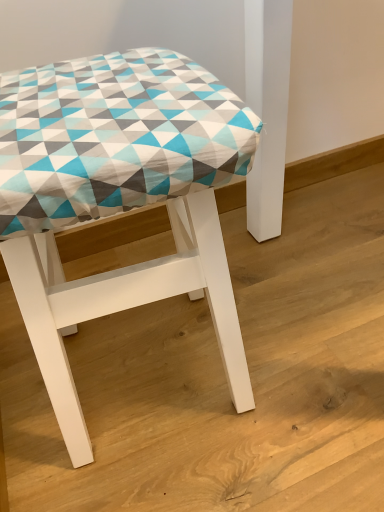
What do you see at coordinates (118, 198) in the screenshot?
I see `matte fabric stool at center` at bounding box center [118, 198].

You are a GUI agent. You are given a task and a screenshot of the screen. Output one action in this format:
    pyautogui.click(x=<x>, y=<y>)
    Task: Click on the matte fabric stool at center
    
    Given the screenshot: What is the action you would take?
    pyautogui.click(x=118, y=198)

Find the location of a particular element. Image resolution: width=384 pixels, height=512 pixels. matte fabric stool at center is located at coordinates (118, 198).